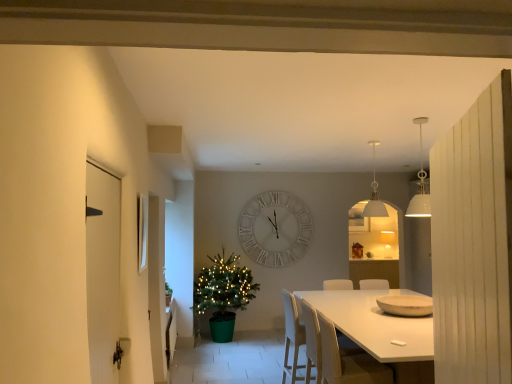
Question: From the image's perspective, does white glossy picture frame at upper left appear higher than white glossy door at left?

Choices:
 (A) no
 (B) yes

Answer: (B)

Question: From the image's perspective, does white glossy picture frame at upper left appear lower than white glossy door at left?

Choices:
 (A) yes
 (B) no

Answer: (B)

Question: From a real-world perspective, is white glossy picture frame at upper left positioned under white glossy door at left based on gravity?

Choices:
 (A) yes
 (B) no

Answer: (B)

Question: Is white glossy picture frame at upper left at the left side of white glossy door at left?

Choices:
 (A) yes
 (B) no

Answer: (A)

Question: Is white glossy picture frame at upper left to the right of white glossy door at left from the viewer's perspective?

Choices:
 (A) no
 (B) yes

Answer: (A)

Question: From a real-world perspective, relative to white matte pendant light at upper center, the 1th lamp from the front, is matte white lampshade at upper center, the 2th lamp when ordered from top to bottom, vertically above or below?

Choices:
 (A) below
 (B) above

Answer: (A)

Question: Is matte white lampshade at upper center, the first lamp from the bottom, bigger or smaller than white matte pendant light at upper center, placed as the 2th lamp when sorted from bottom to top?

Choices:
 (A) small
 (B) big

Answer: (A)

Question: Is matte white lampshade at upper center, the first lamp in the right-to-left sequence, to the left or to the right of white matte pendant light at upper center, arranged as the second lamp when viewed from the back, in the image?

Choices:
 (A) right
 (B) left

Answer: (A)

Question: Is matte white lampshade at upper center, which appears as the 2th lamp when viewed from the left, inside the boundaries of white matte pendant light at upper center, which ranks as the 2th lamp in right-to-left order, or outside?

Choices:
 (A) outside
 (B) inside

Answer: (A)

Question: Based on their positions, is white glossy door at left located to the left or right of white plastic chair at center?

Choices:
 (A) left
 (B) right

Answer: (A)

Question: From the image's perspective, is white glossy door at left above or below white plastic chair at center?

Choices:
 (A) above
 (B) below

Answer: (A)

Question: Relative to white plastic chair at center, is white glossy door at left in front or behind?

Choices:
 (A) front
 (B) behind

Answer: (A)

Question: Considering the positions of white glossy door at left and white plastic chair at center in the image, is white glossy door at left taller or shorter than white plastic chair at center?

Choices:
 (A) short
 (B) tall

Answer: (B)

Question: Based on their sizes in the image, would you say white glossy picture frame at upper left is bigger or smaller than matte white lampshade at upper center, the 2th lamp when ordered from top to bottom?

Choices:
 (A) small
 (B) big

Answer: (A)

Question: Is white glossy picture frame at upper left to the left or to the right of matte white lampshade at upper center, which appears as the 2th lamp when viewed from the left, in the image?

Choices:
 (A) right
 (B) left

Answer: (B)